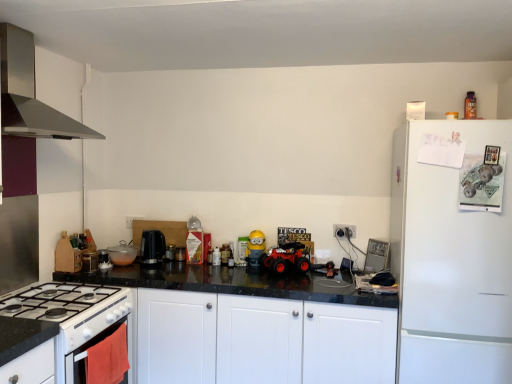
Measure the distance between point [154,267] and camera.

Point [154,267] is 9.11 feet away from camera.

The height and width of the screenshot is (384, 512). Describe the element at coordinates (251, 325) in the screenshot. I see `black granite countertop at center` at that location.

Where is `translucent glass bowl at center, arranged as the first kitchen appliance when viewed from the back`? translucent glass bowl at center, arranged as the first kitchen appliance when viewed from the back is located at coordinates (122, 254).

The image size is (512, 384). What are the coordinates of `black plastic kettle at center, placed as the first appliance when sorted from left to right` in the screenshot? It's located at (170, 252).

Where is `matte red plastic toy car at center`? Image resolution: width=512 pixels, height=384 pixels. matte red plastic toy car at center is located at coordinates (285, 259).

Which of these two, white glossy gas stove at lower left or metallic black kettle at center, which is the 1th appliance from right to left, is smaller?

metallic black kettle at center, which is the 1th appliance from right to left.

In the image, is white glossy gas stove at lower left positioned in front of or behind metallic black kettle at center, which is the 1th appliance from right to left?

Visually, white glossy gas stove at lower left is located in front of metallic black kettle at center, which is the 1th appliance from right to left.

At what (x,y) coordinates should I click in order to perform the action: click on gas stove below the metallic black kettle at center, which is the 1th appliance from right to left (from a real-world perspective). Please return your answer as a coordinate pair (x, y). Looking at the image, I should click on (55, 301).

From a real-world perspective, does white glossy oven at lower left sit lower than white matte refrigerator at right?

Correct, in the physical world, white glossy oven at lower left is lower than white matte refrigerator at right.

Is the position of white glossy oven at lower left more distant than that of white matte refrigerator at right?

No, the depth of white glossy oven at lower left is less than that of white matte refrigerator at right.

Is white glossy oven at lower left wider than white matte refrigerator at right?

No.

Where is `toy that is above the white matte refrigerator at right (from the image's perspective)`? Image resolution: width=512 pixels, height=384 pixels. toy that is above the white matte refrigerator at right (from the image's perspective) is located at coordinates (255, 248).

Could white matte refrigerator at right be considered to be inside yellow matte minion at center?

No.

Which is less distant, (259, 230) or (419, 316)?

Point (259, 230) appears to be farther away from the viewer than point (419, 316).

Could you tell me if yellow matte minion at center is turned towards white matte refrigerator at right?

No, yellow matte minion at center does not turn towards white matte refrigerator at right.

Which point is more forward, (144,261) or (168,251)?

The point (144,261) is closer.

In terms of width, does black plastic coffee machine at center look wider or thinner when compared to black plastic kettle at center, which is counted as the second appliance, starting from the right?

black plastic coffee machine at center is wider than black plastic kettle at center, which is counted as the second appliance, starting from the right.

Is black plastic coffee machine at center in front of black plastic kettle at center, placed as the first appliance when sorted from left to right?

Yes, the depth of black plastic coffee machine at center is less than that of black plastic kettle at center, placed as the first appliance when sorted from left to right.

Which of these two, stainless steel range hood at upper left, the second kitchen appliance from the back, or matte red plastic toy car at center, is thinner?

matte red plastic toy car at center is thinner.

Between point (61, 136) and point (281, 260), which one is positioned behind?

Positioned behind is point (281, 260).

Is stainless steel range hood at upper left, the 1th kitchen appliance from the front, oriented towards matte red plastic toy car at center?

No, stainless steel range hood at upper left, the 1th kitchen appliance from the front, is not oriented towards matte red plastic toy car at center.

Considering their positions, is stainless steel range hood at upper left, marked as the 2th kitchen appliance in a bottom-to-top arrangement, located in front of or behind matte red plastic toy car at center?

In the image, stainless steel range hood at upper left, marked as the 2th kitchen appliance in a bottom-to-top arrangement, appears in front of matte red plastic toy car at center.

Does point (154, 243) lie behind point (445, 269)?

Yes, point (154, 243) is farther from viewer.

From a real-world perspective, relative to white matte refrigerator at right, is black plastic coffee machine at center vertically above or below?

From a real-world perspective, black plastic coffee machine at center is physically above white matte refrigerator at right.

Which object is wider, black plastic coffee machine at center or white matte refrigerator at right?

With larger width is white matte refrigerator at right.

Is black plastic coffee machine at center far away from white matte refrigerator at right?

Yes, black plastic coffee machine at center and white matte refrigerator at right are located far from each other.

In the scene shown: In terms of height, does translucent glass bowl at center, the 2th kitchen appliance positioned from the top, look taller or shorter compared to black plastic kettle at center, which is counted as the second appliance, starting from the right?

Considering their sizes, translucent glass bowl at center, the 2th kitchen appliance positioned from the top, has more height than black plastic kettle at center, which is counted as the second appliance, starting from the right.

From the image's perspective, is translucent glass bowl at center, the first kitchen appliance when ordered from bottom to top, above black plastic kettle at center, which is counted as the second appliance, starting from the right?

Yes, from the image's perspective, translucent glass bowl at center, the first kitchen appliance when ordered from bottom to top, is over black plastic kettle at center, which is counted as the second appliance, starting from the right.

Between translucent glass bowl at center, the 2th kitchen appliance positioned from the top, and black plastic kettle at center, placed as the first appliance when sorted from left to right, which one has larger size?

translucent glass bowl at center, the 2th kitchen appliance positioned from the top.

Is translucent glass bowl at center, the first kitchen appliance when ordered from bottom to top, closer to camera compared to black plastic kettle at center, placed as the first appliance when sorted from left to right?

Yes, translucent glass bowl at center, the first kitchen appliance when ordered from bottom to top, is in front of black plastic kettle at center, placed as the first appliance when sorted from left to right.

The height and width of the screenshot is (384, 512). There is a white glossy gas stove at lower left. Find the location of `the 1st appliance above it (from the image's perspective)`. the 1st appliance above it (from the image's perspective) is located at coordinates (180, 254).

I want to click on oven that appears in front of the white matte refrigerator at right, so click(x=92, y=333).

From the image, which object appears to be nearer to black plastic kettle at center, placed as the first appliance when sorted from left to right, white glossy gas stove at lower left or yellow matte minion at center?

yellow matte minion at center is positioned closer to the anchor black plastic kettle at center, placed as the first appliance when sorted from left to right.

From the image, which object appears to be farther from black plastic kettle at center, placed as the first appliance when sorted from left to right, white glossy gas stove at lower left or metallic black kettle at center, which is the 2th appliance in left-to-right order?

white glossy gas stove at lower left is further to black plastic kettle at center, placed as the first appliance when sorted from left to right.

When comparing their distances from black plastic kettle at center, which is counted as the second appliance, starting from the right, does translucent glass bowl at center, which is counted as the second kitchen appliance, starting from the front, or matte red plastic toy car at center seem further?

matte red plastic toy car at center lies further to black plastic kettle at center, which is counted as the second appliance, starting from the right, than the other object.

Looking at the image, which one is located further to yellow matte minion at center, stainless steel range hood at upper left, which is the 1th kitchen appliance in top-to-bottom order, or black plastic coffee machine at center?

The object further to yellow matte minion at center is stainless steel range hood at upper left, which is the 1th kitchen appliance in top-to-bottom order.

Based on their spatial positions, is white glossy oven at lower left or black plastic coffee machine at center further from white glossy gas stove at lower left?

black plastic coffee machine at center is further to white glossy gas stove at lower left.

Based on their spatial positions, is stainless steel range hood at upper left, marked as the 2th kitchen appliance in a bottom-to-top arrangement, or translucent glass bowl at center, which is counted as the second kitchen appliance, starting from the front, further from white matte refrigerator at right?

stainless steel range hood at upper left, marked as the 2th kitchen appliance in a bottom-to-top arrangement, lies further to white matte refrigerator at right than the other object.

Considering their positions, is black plastic kettle at center, placed as the first appliance when sorted from left to right, positioned further to white glossy gas stove at lower left than yellow matte minion at center?

yellow matte minion at center is positioned further to the anchor white glossy gas stove at lower left.

Based on their spatial positions, is black plastic coffee machine at center or yellow matte minion at center closer to matte red plastic toy car at center?

The object closer to matte red plastic toy car at center is yellow matte minion at center.

Where is `toy located between white glossy oven at lower left and metallic black kettle at center, which is the 2th appliance in left-to-right order, in the depth direction`? toy located between white glossy oven at lower left and metallic black kettle at center, which is the 2th appliance in left-to-right order, in the depth direction is located at coordinates (255, 248).

Where is `counter between white glossy oven at lower left and metallic black kettle at center, which is the 2th appliance in left-to-right order, along the z-axis`? This screenshot has width=512, height=384. counter between white glossy oven at lower left and metallic black kettle at center, which is the 2th appliance in left-to-right order, along the z-axis is located at coordinates (251, 325).

Identify the location of kitchen appliance positioned between black granite countertop at center and black plastic kettle at center, placed as the first appliance when sorted from left to right, from near to far. The width and height of the screenshot is (512, 384). (122, 254).

Locate an element on the screen. coffee machine between stainless steel range hood at upper left, the second kitchen appliance from the back, and yellow matte minion at center from front to back is located at coordinates (152, 247).